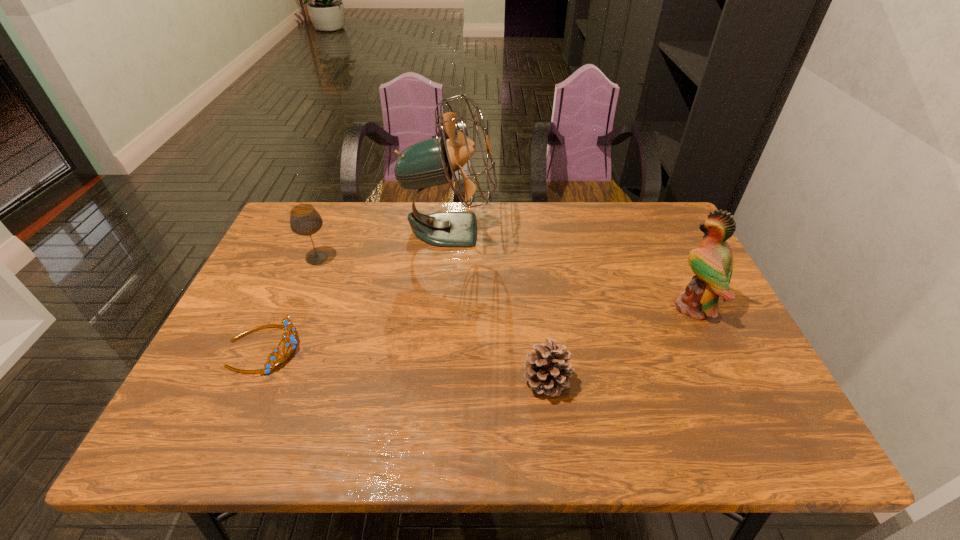
At what (x,y) coordinates should I click in order to perform the action: click on free point between the shortest object and the pinecone. Please return your answer as a coordinate pair (x, y). Looking at the image, I should click on coord(405,364).

The height and width of the screenshot is (540, 960). Find the location of `free spot between the tiara and the wineglass`. free spot between the tiara and the wineglass is located at coordinates (291, 303).

Where is `free space between the shortest object and the fan`? This screenshot has height=540, width=960. free space between the shortest object and the fan is located at coordinates (356, 288).

The image size is (960, 540). I want to click on empty space between the pinecone and the rightmost object, so click(620, 344).

In order to click on free space between the tiara and the fourth tallest object in this screenshot , I will do `click(405, 364)`.

The height and width of the screenshot is (540, 960). I want to click on object that is the third closest to the third object from left to right, so click(x=548, y=369).

You are a GUI agent. You are given a task and a screenshot of the screen. Output one action in this format:
    pyautogui.click(x=<x>, y=<y>)
    Task: Click on the object that ranks as the closest to the third object from left to right
    The height and width of the screenshot is (540, 960).
    Given the screenshot: What is the action you would take?
    pyautogui.click(x=304, y=219)

Find the location of a particular element. vacant area that satisfies the following two spatial constraints: 1. on the front-facing side of the fourth tallest object; 2. on the left side of the shortest object is located at coordinates (249, 381).

You are a GUI agent. You are given a task and a screenshot of the screen. Output one action in this format:
    pyautogui.click(x=<x>, y=<y>)
    Task: Click on the free point that satisfies the following two spatial constraints: 1. on the back side of the second shortest object; 2. on the front-facing side of the shortest object
    The height and width of the screenshot is (540, 960).
    Given the screenshot: What is the action you would take?
    pyautogui.click(x=542, y=348)

In order to click on blank area in the image that satisfies the following two spatial constraints: 1. on the front-facing side of the pinecone; 2. on the left side of the shortest object in this screenshot , I will do `click(249, 381)`.